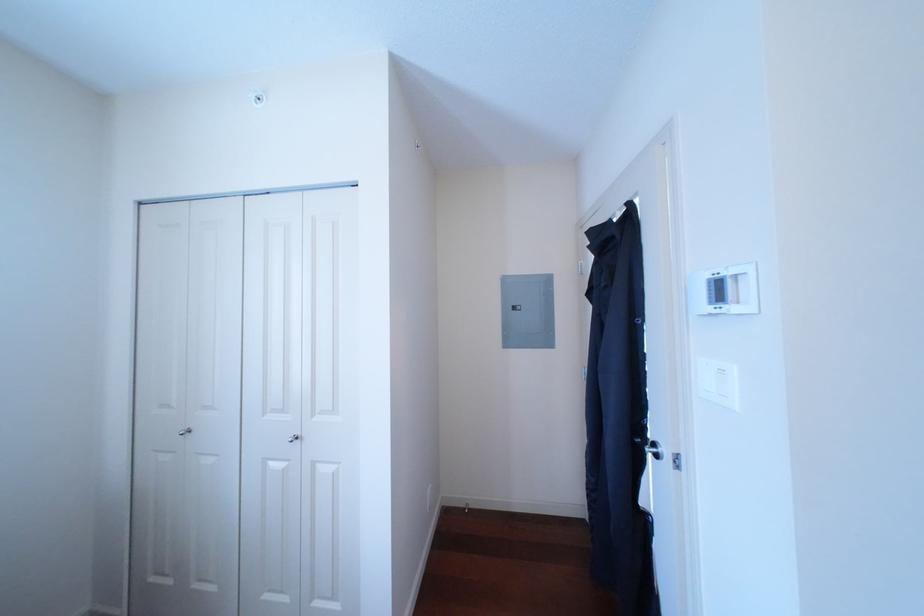
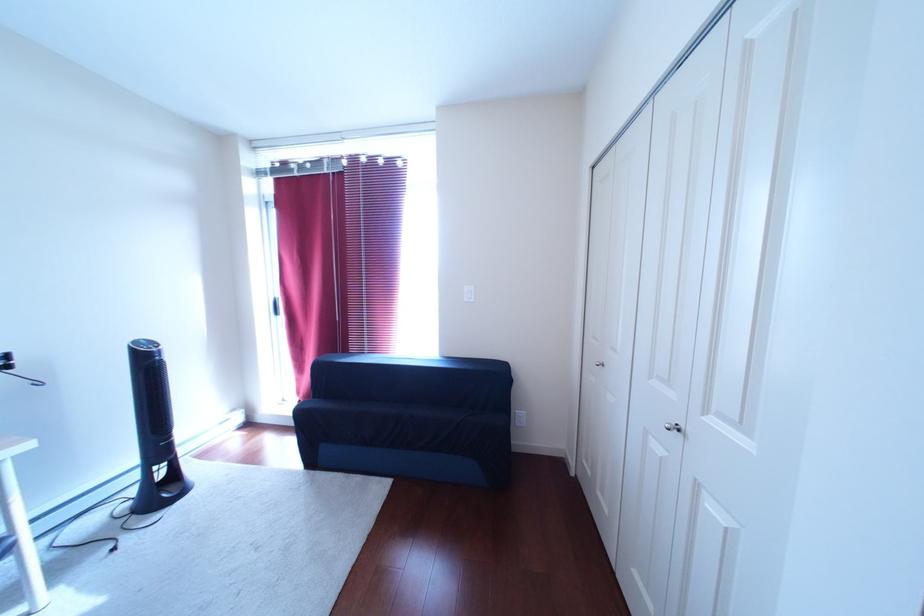
Question: The first image is from the beginning of the video and the second image is from the end. How did the camera likely rotate when shooting the video?

Choices:
 (A) Left
 (B) Right
 (C) Up
 (D) Down

Answer: (A)